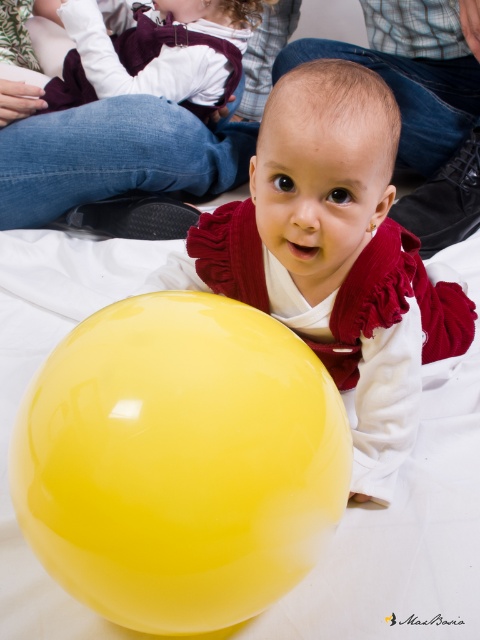
You are a photographer setting up for a baby photoshoot. You have two objects in the scene, the glossy yellow balloon at center and the glossy yellow ball at lower left. Which object is shorter in height?

The glossy yellow balloon at center has a lesser height compared to the glossy yellow ball at lower left, so the glossy yellow balloon at center is shorter.

You are a photographer setting up for a baby photoshoot. You have two objects in the scene, the glossy yellow balloon at center and the glossy yellow ball at lower left. Which object should you focus on if you want to capture the larger one in your shot?

The glossy yellow ball at lower left is larger than the glossy yellow balloon at center, so you should focus on the glossy yellow ball at lower left to capture the larger one.